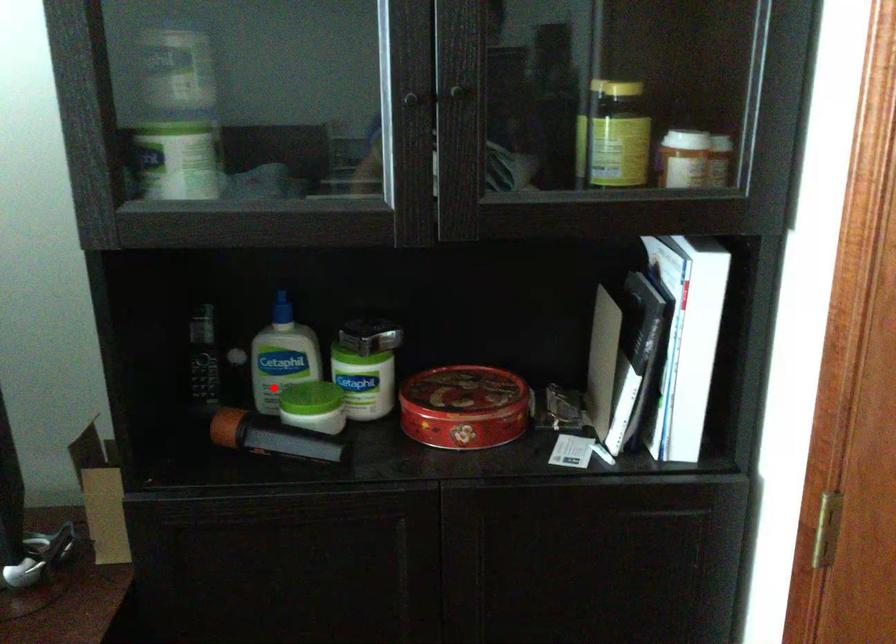
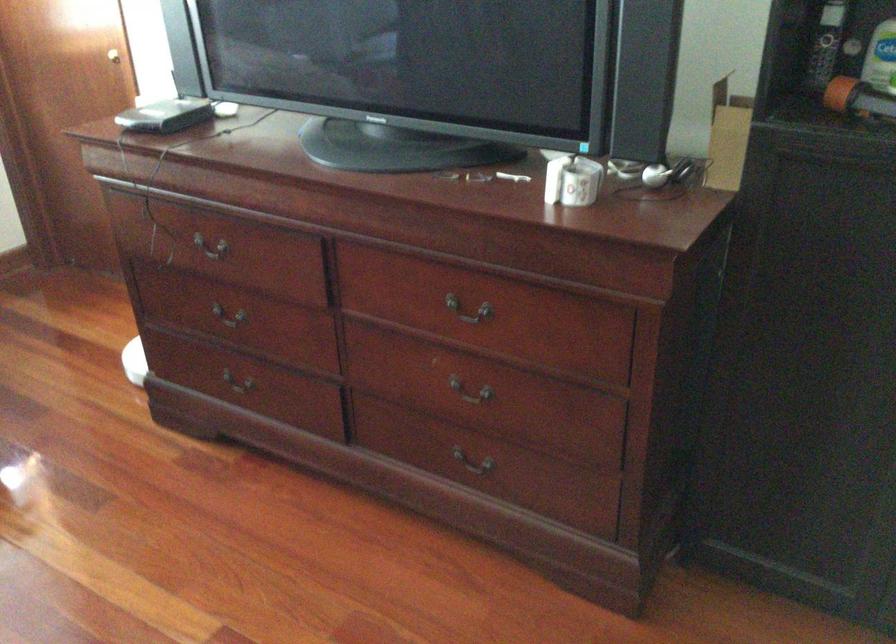
Find the pixel in the second image that matches the highlighted location in the first image.

(883, 77)